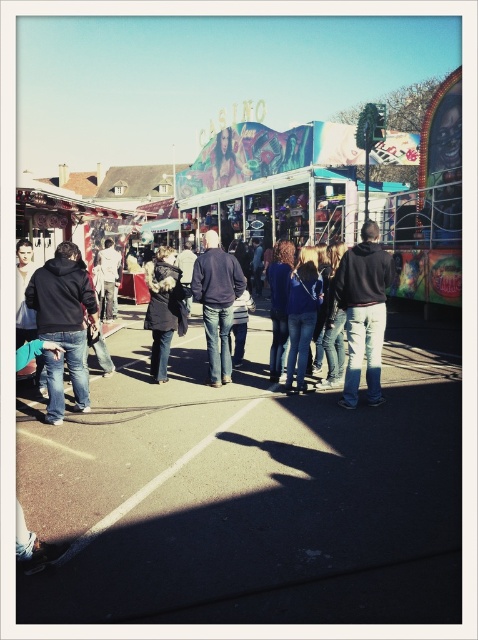
Is dark blue hoodie at left bigger than denim jacket at center?

Yes.

The width and height of the screenshot is (478, 640). What do you see at coordinates (65, 310) in the screenshot?
I see `dark blue hoodie at left` at bounding box center [65, 310].

Does point (80, 339) lie in front of point (110, 273)?

Yes, point (80, 339) is closer to viewer.

Find the location of `dark blue hoodie at left`. dark blue hoodie at left is located at coordinates (65, 310).

Is point (154, 269) farther from viewer compared to point (292, 356)?

Yes, point (154, 269) is farther from viewer.

Measure the distance between point (162,355) and camera.

They are 27.87 feet apart.

Does point (171, 323) lie in front of point (297, 296)?

No, (171, 323) is further to viewer.

Image resolution: width=478 pixels, height=640 pixels. In order to click on dark brown leather jacket at center in this screenshot , I will do `click(162, 310)`.

Is dark blue hoodie at left wider than blue jeans at center?

Indeed, dark blue hoodie at left has a greater width compared to blue jeans at center.

Is dark blue hoodie at left behind blue jeans at center?

That is False.

You are a GUI agent. You are given a task and a screenshot of the screen. Output one action in this format:
    pyautogui.click(x=<x>, y=<y>)
    Task: Click on the dark blue hoodie at left
    
    Given the screenshot: What is the action you would take?
    pyautogui.click(x=65, y=310)